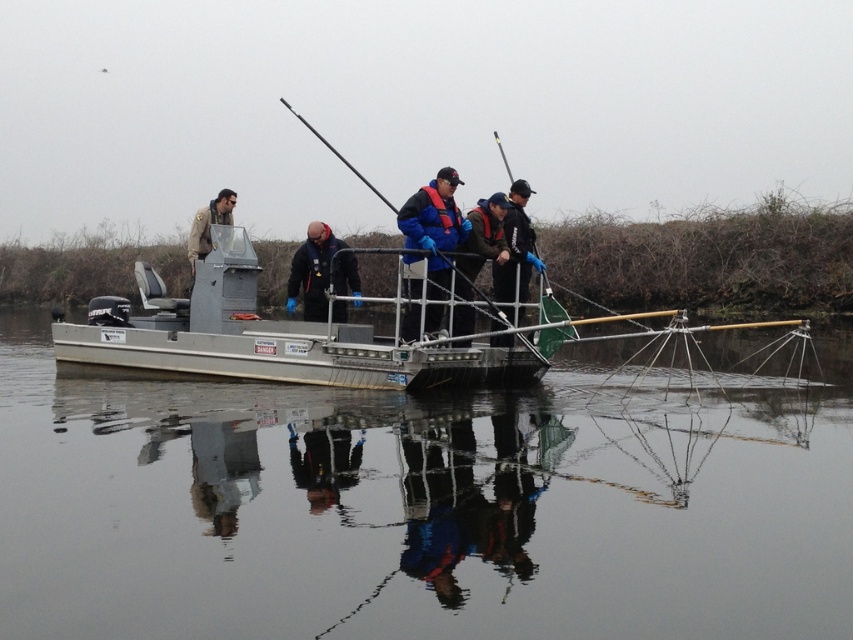
Question: In this image, where is dark blue jacket at center located relative to blue rubber gloves at center?

Choices:
 (A) left
 (B) right

Answer: (A)

Question: Which object is the closest to the metallic fishing pole at center?

Choices:
 (A) matte black jacket at left
 (B) blue rubber gloves at center
 (C) silver metallic boat at center
 (D) smooth gray water at center

Answer: (A)

Question: Can you confirm if blue fleece jacket at center is positioned above metallic fishing pole at center?

Choices:
 (A) no
 (B) yes

Answer: (A)

Question: Which object appears closest to the camera in this image?

Choices:
 (A) metallic fishing pole at center
 (B) matte black jacket at left

Answer: (B)

Question: Which of these objects is positioned farthest from the metallic fishing pole at center?

Choices:
 (A) blue rubber gloves at center
 (B) silver metallic boat at center
 (C) blue fabric jacket at center

Answer: (C)

Question: Is matte black jacket at left below metallic fishing pole at center?

Choices:
 (A) no
 (B) yes

Answer: (B)